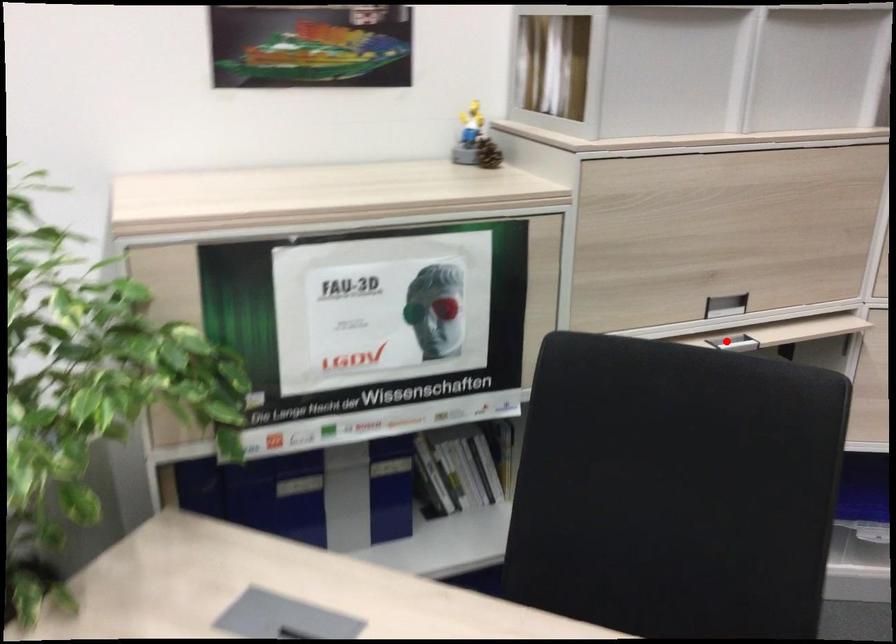
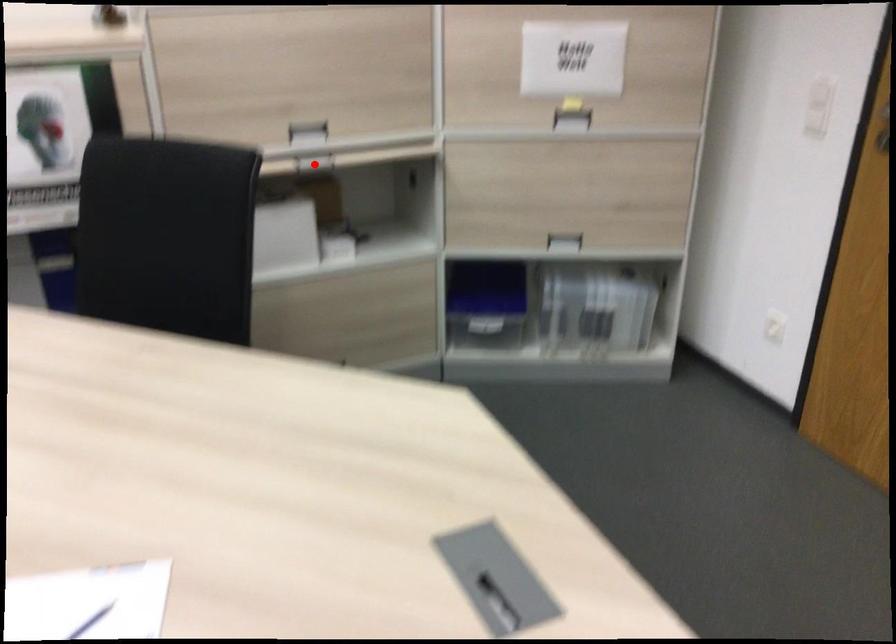
I am providing you with two images of the same scene from different viewpoints. A red point is marked on the first image and another point is marked on the second image. Are the points marked in image1 and image2 representing the same 3D position?

Yes